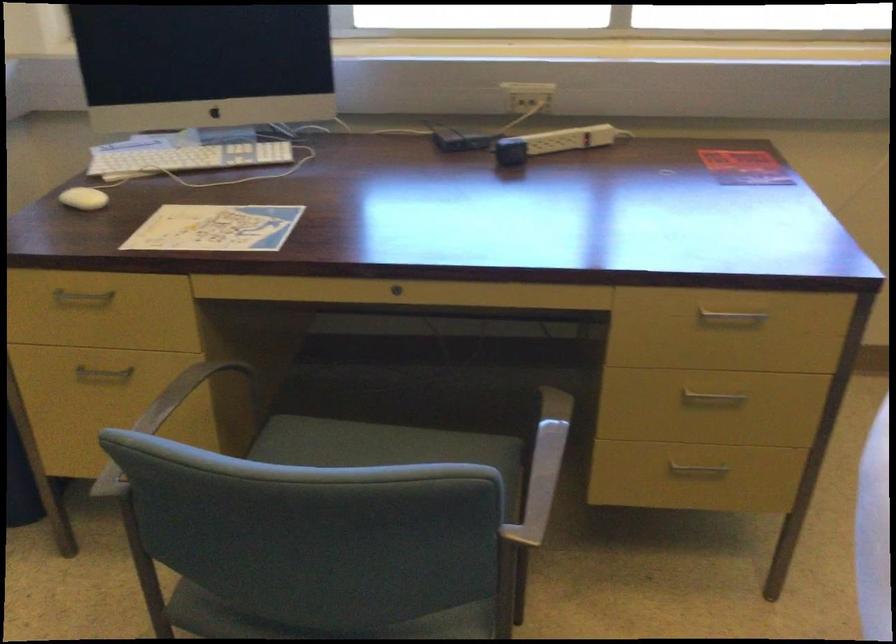
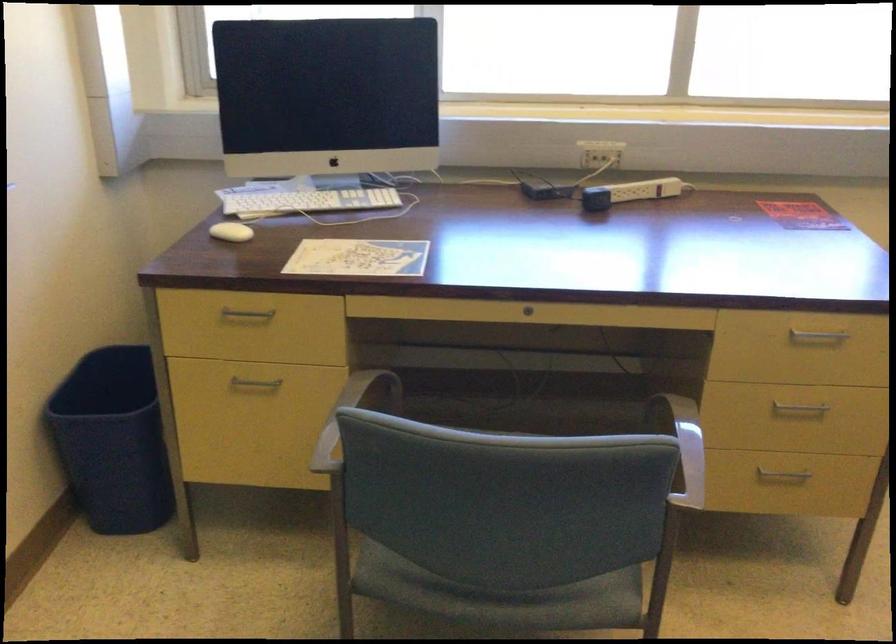
Where in the second image is the point corresponding to (728,319) from the first image?

(816, 336)